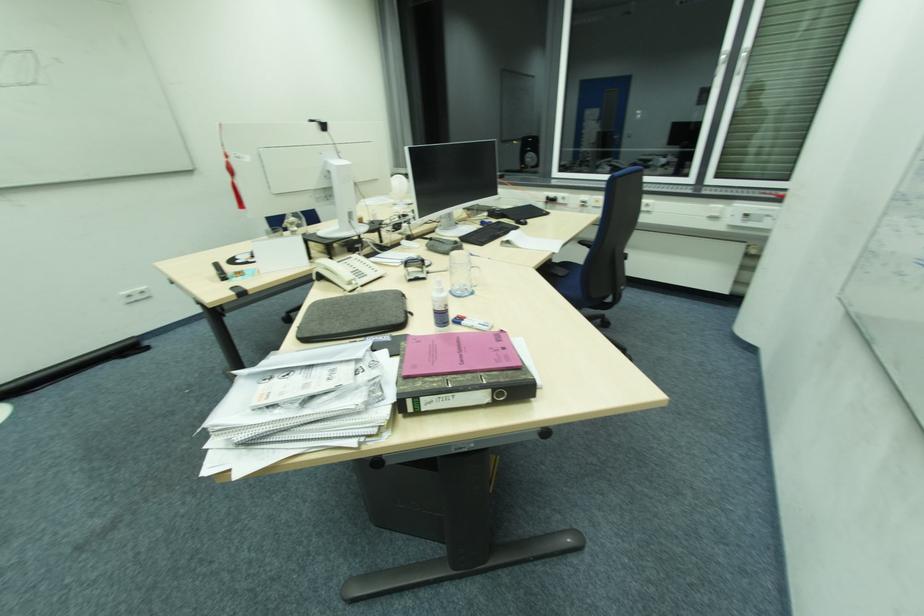
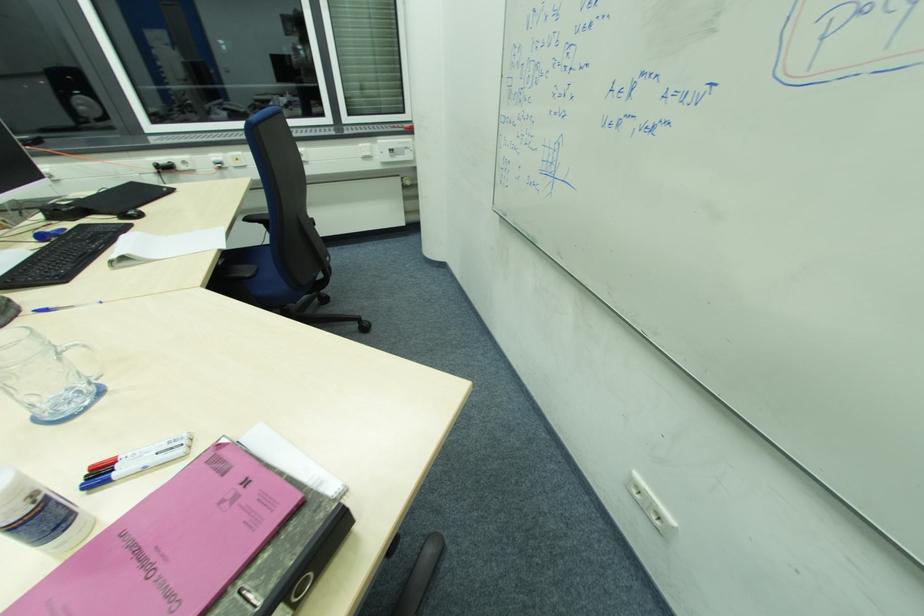
The images are taken continuously from a first-person perspective. In which direction is your viewpoint rotating?

The rotation direction of the camera is right-down.